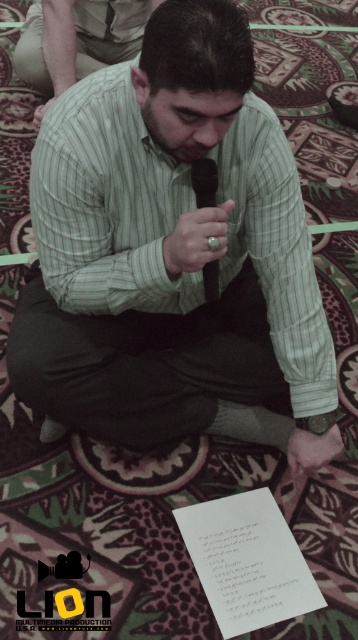
Does green striped shirt at center have a smaller size compared to black silk tie at center?

No, green striped shirt at center is not smaller than black silk tie at center.

Who is shorter, green striped shirt at center or black silk tie at center?

black silk tie at center is shorter.

This screenshot has width=358, height=640. What do you see at coordinates (173, 253) in the screenshot?
I see `green striped shirt at center` at bounding box center [173, 253].

This screenshot has height=640, width=358. I want to click on green striped shirt at center, so click(x=173, y=253).